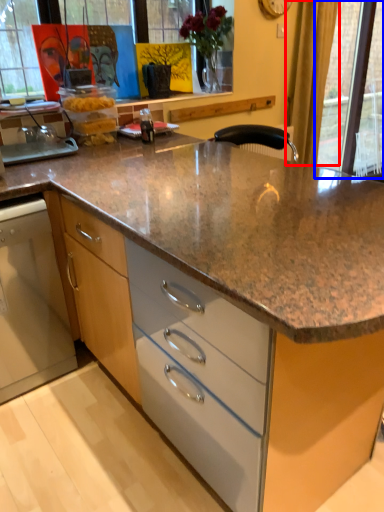
Question: Which point is further to the camera, curtain (highlighted by a red box) or glass door (highlighted by a blue box)?

Choices:
 (A) curtain
 (B) glass door

Answer: (B)